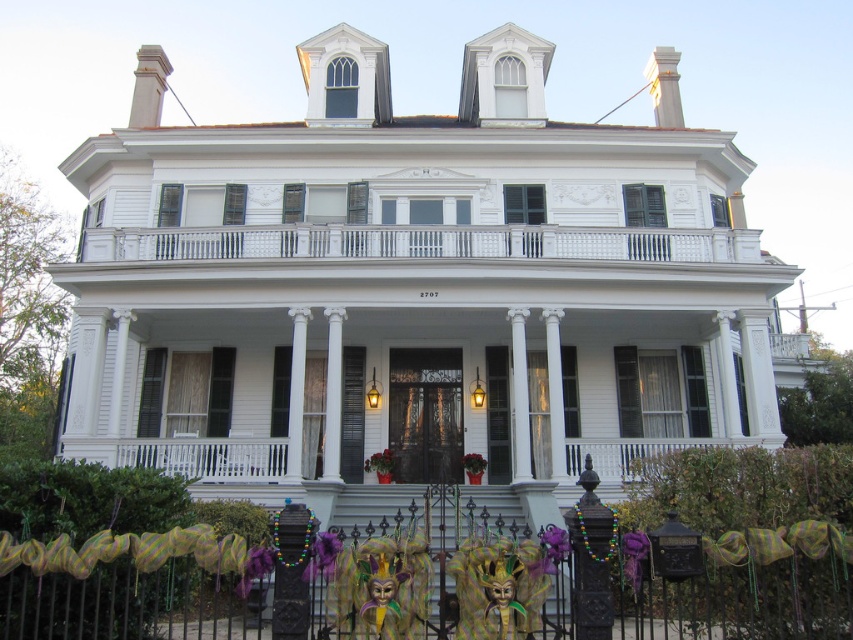
Question: Is metallic wrought iron at lower center positioned at the back of white painted wood railing at upper center?

Choices:
 (A) no
 (B) yes

Answer: (A)

Question: Is metallic wrought iron at lower center positioned behind white painted wood railing at upper center?

Choices:
 (A) no
 (B) yes

Answer: (A)

Question: Is metallic wrought iron at lower center closer to camera compared to white painted wood railing at upper center?

Choices:
 (A) no
 (B) yes

Answer: (B)

Question: Which point is farther to the camera?

Choices:
 (A) metallic wrought iron at lower center
 (B) white painted wood railing at upper center

Answer: (B)

Question: Which of the following is the closest to the observer?

Choices:
 (A) white painted wood railing at upper center
 (B) metallic wrought iron at lower center

Answer: (B)

Question: Among these objects, which one is farthest from the camera?

Choices:
 (A) white painted wood railing at upper center
 (B) metallic wrought iron at lower center

Answer: (A)